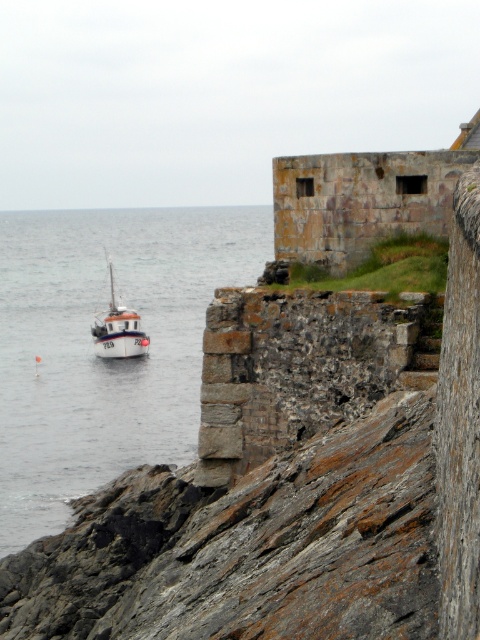
Is clear water at left shorter than white matte boat at left?

No.

Is point (145, 436) positioned in front of point (120, 314)?

Yes, it is in front of point (120, 314).

This screenshot has height=640, width=480. Find the location of `clear water at left`. clear water at left is located at coordinates (93, 346).